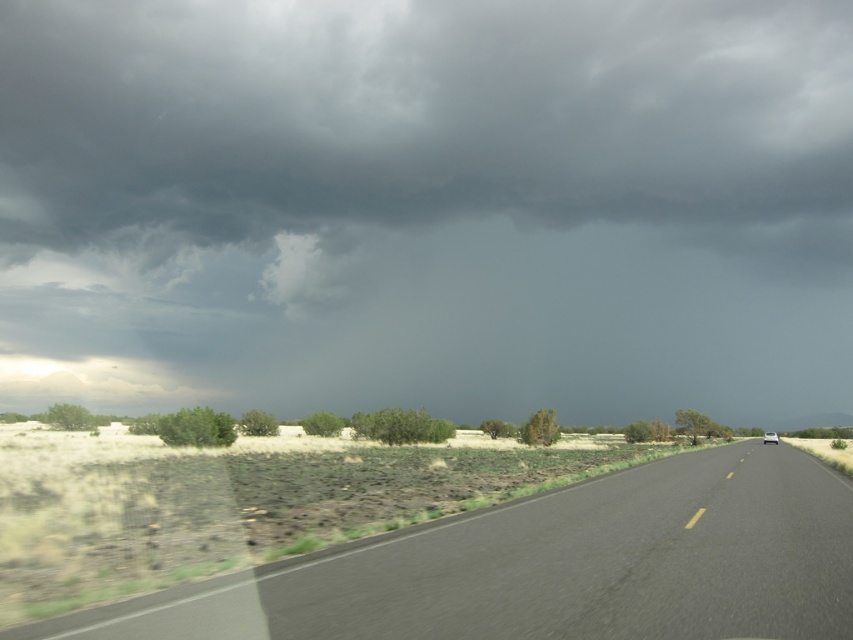
You are standing at the camera position and want to reach the point at coordinates (344, 560). The road is 3 meters wide. Can you walk straight along the road to reach the point without crossing the center dashed line?

The point at coordinates (344, 560) is 8.74 meters away from the camera. Since the road is 3 meters wide, and the center dashed line is in the middle, the maximum distance you can walk without crossing the center line is 1.5 meters from the edge. Therefore, you would need to cross the center dashed line to reach the point at 8.74 meters, so you cannot walk straight along the road to reach it without crossing the center dashed line.

You are standing at the point marked by the coordinates point (552, 566). What is the surface material you are currently standing on?

The point (552, 566) marks black asphalt road at center, so the surface material is asphalt.

You are a driver approaching the white glossy car at right on the black asphalt road at center. According to the scene, which direction should you steer to stay on the road?

The black asphalt road at center is to the left of the white glossy car at right, so you should steer to the left to stay on the road.